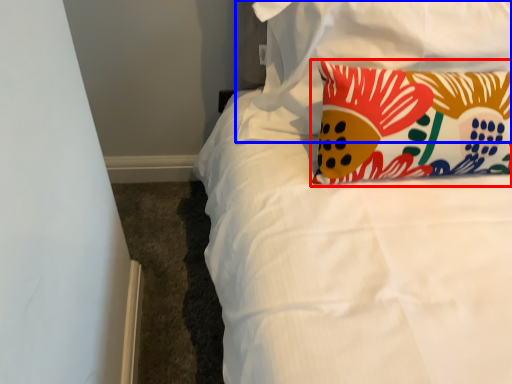
Question: Which point is further to the camera, pillow (highlighted by a red box) or pillow (highlighted by a blue box)?

Choices:
 (A) pillow
 (B) pillow

Answer: (B)